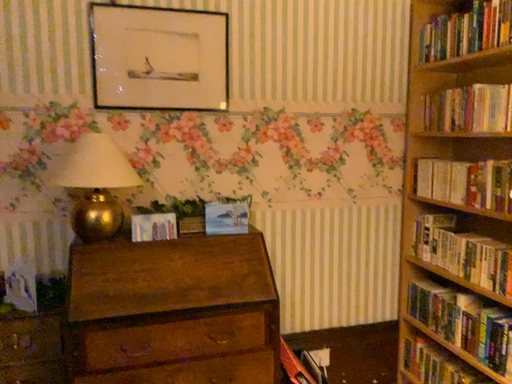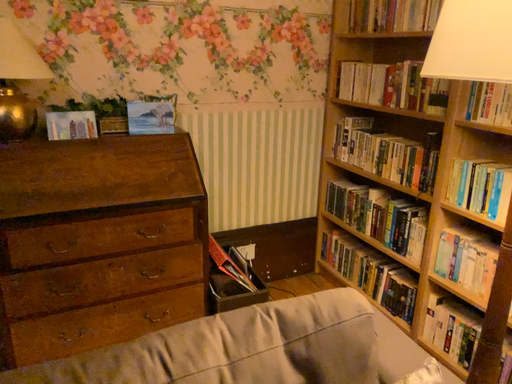
Question: How did the camera likely rotate when shooting the video?

Choices:
 (A) rotated downward
 (B) rotated upward

Answer: (A)